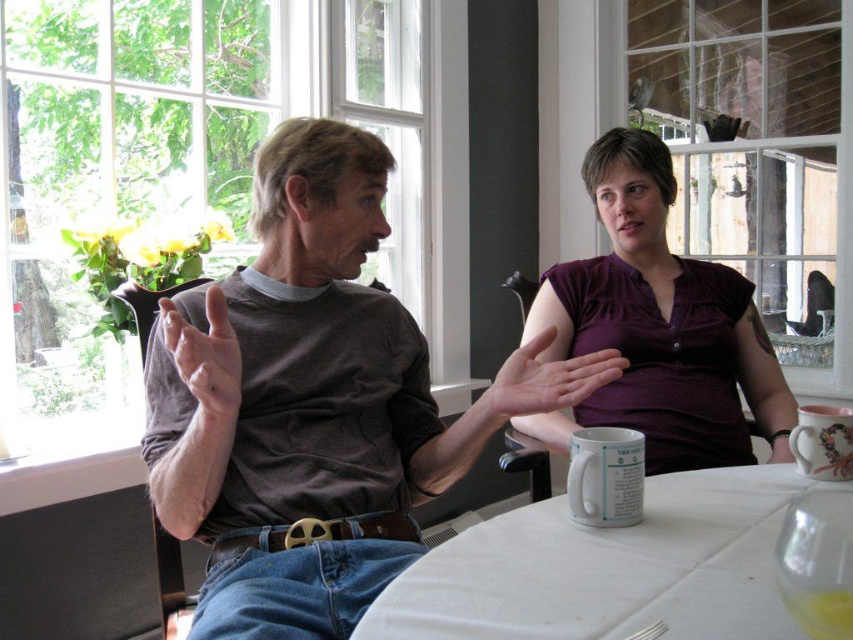
You are a tailor measuring fabrics for a project. You have a brown cotton shirt at left and a white fabric table at center. Which item is wider?

The brown cotton shirt at left is wider than the white fabric table at center.

You are standing in a room and see the white fabric table at center. If you were to walk directly towards it from the entrance, which direction should you face? The entrance is located to the north of the room.

The white fabric table at center is located at coordinates 0.889 on the x axis and 0.714 on the y axis. Since the entrance is to the north, you should face south to walk directly towards the table.